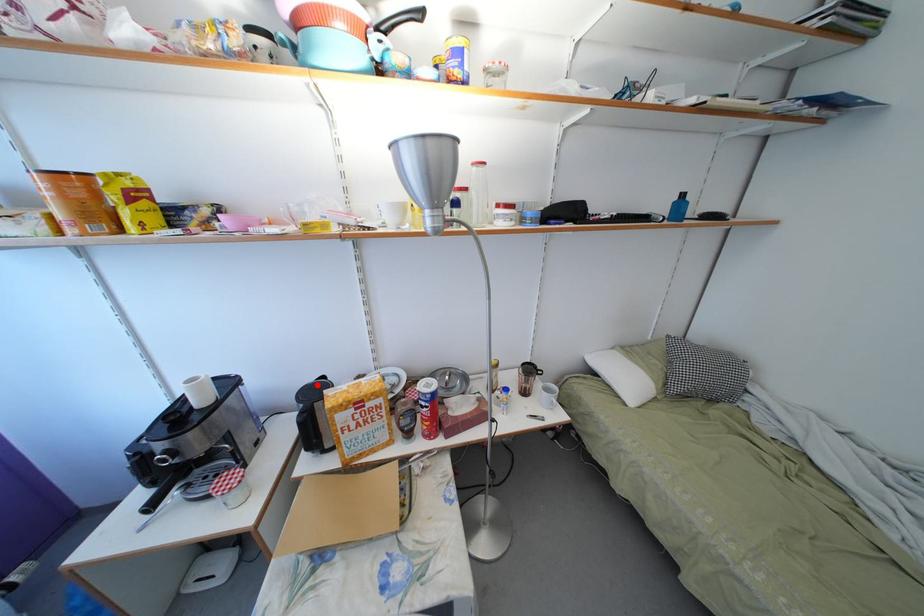
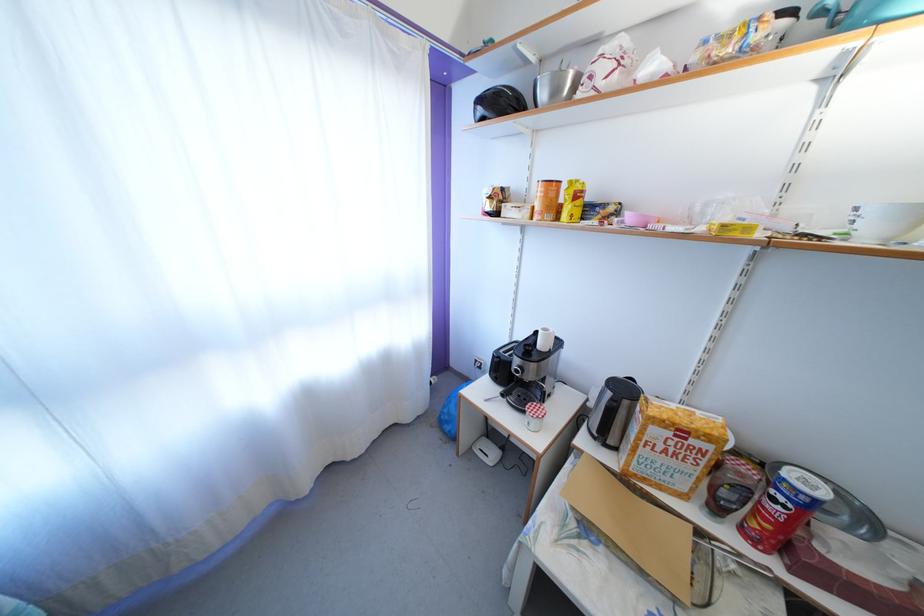
Locate, in the second image, the point that corresponds to the highlighted location in the first image.

(626, 379)